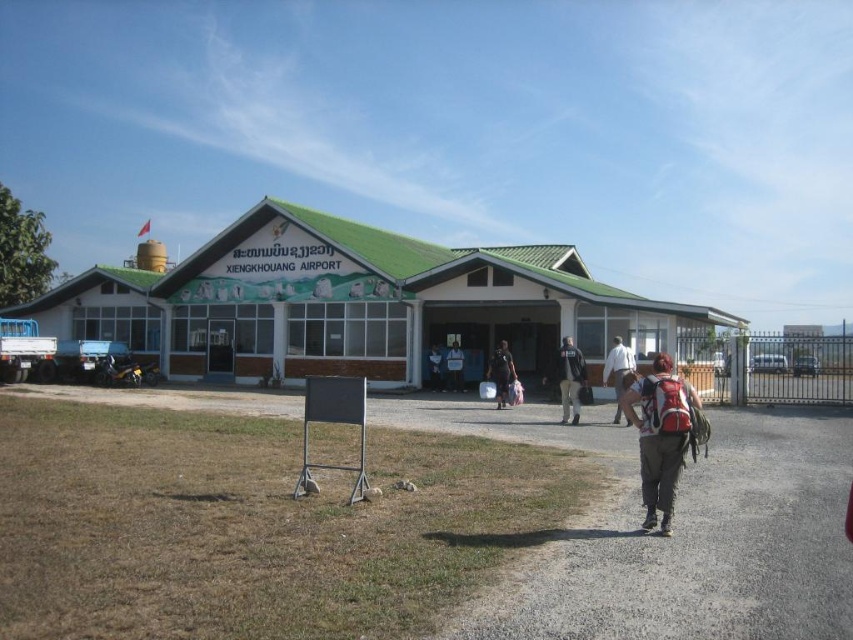
You are a traveler carrying a 1.2 meter wide luggage cart. You need to move from the red backpack at lower right to the light brown leather pants at center. Can your cart fit through the space between them?

The distance between the red backpack at lower right and the light brown leather pants at center is 12.44 meters, which is significantly wider than your 1.2 meter wide luggage cart. Therefore, the cart can easily pass through the space between them.